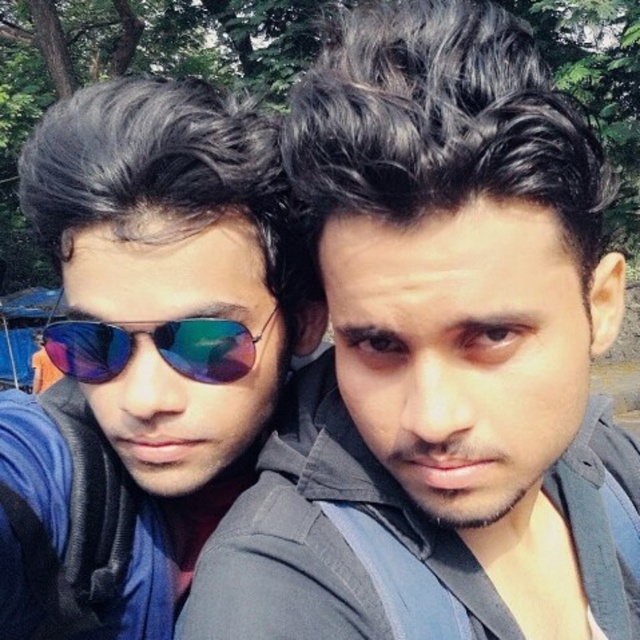
You are taking a photo of the two people in the scene. The dark gray hair at center and the shiny reflective sunglasses at center are both in your frame. Which object is closer to the camera?

The dark gray hair at center is closer to the camera because it is in front of the shiny reflective sunglasses at center.

You are taking a photo of two people and notice the dark gray hair at center and the matte black sunglasses at left. Which object is positioned higher in the image?

The dark gray hair at center is much taller than the matte black sunglasses at left, so it is positioned higher in the image.